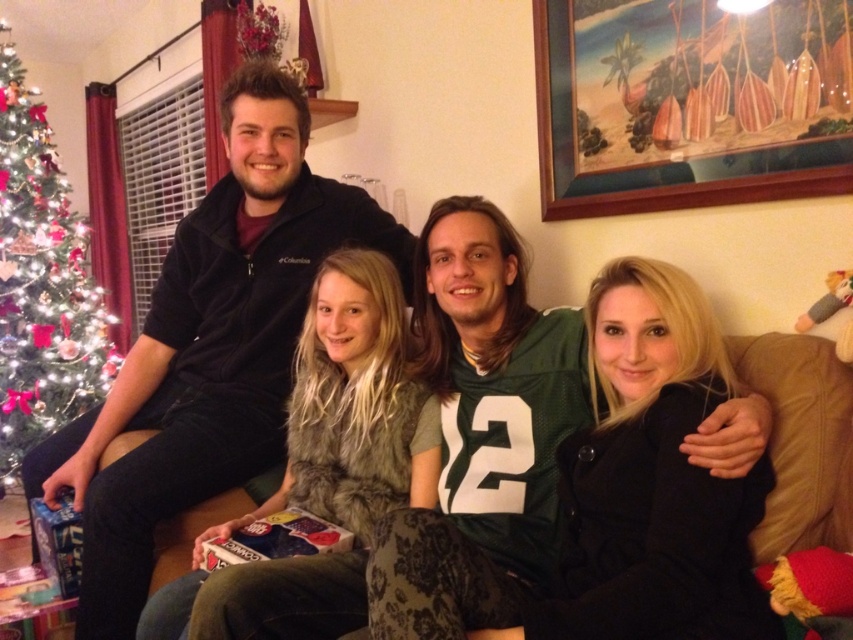
In the scene shown: You are standing at the camera position and want to place a 3.5 meter long banner from the green artificial christmas tree at left to the opposite wall. Is the banner long enough?

The distance between the green artificial christmas tree at left and the camera is 3.37 meters. Since the banner is 3.5 meters long, it is slightly longer than the required distance. Therefore, the banner is long enough to span from the green artificial christmas tree at left to the opposite wall.